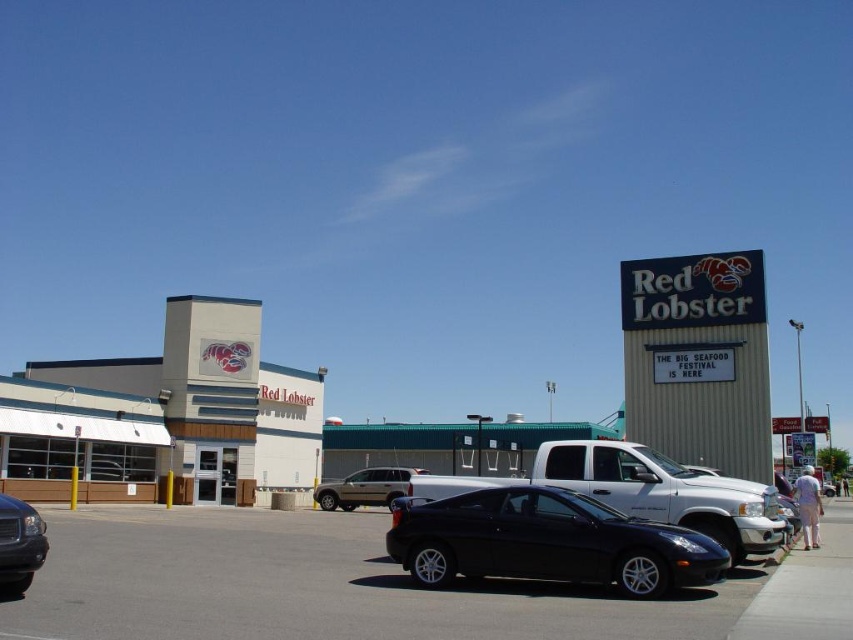
Question: Estimate the real-world distances between objects in this image. Which object is closer to the metallic silver suv at center?

Choices:
 (A) matte white building at left
 (B) shiny black car at center
 (C) black car at center

Answer: (A)

Question: Is black car at center positioned behind shiny black sedan at lower left?

Choices:
 (A) yes
 (B) no

Answer: (B)

Question: Is shiny black car at center to the left of shiny black sedan at lower left from the viewer's perspective?

Choices:
 (A) no
 (B) yes

Answer: (A)

Question: Which object is positioned farthest from the metallic silver suv at center?

Choices:
 (A) shiny black car at center
 (B) black car at center
 (C) shiny black sedan at center

Answer: (A)

Question: Which object is farther from the camera taking this photo?

Choices:
 (A) metallic silver suv at center
 (B) shiny black sedan at lower left

Answer: (A)

Question: Is shiny black sedan at lower left in front of metallic silver suv at center?

Choices:
 (A) no
 (B) yes

Answer: (B)